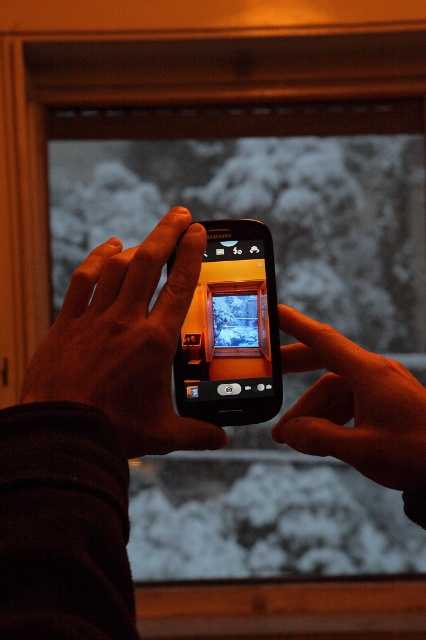
Is orange matte hand at center positioned at the back of black glossy phone at center?

No.

Measure the distance between point (305, 364) and camera.

Point (305, 364) is 23.88 inches from camera.

Which is behind, point (423, 408) or point (275, 289)?

The point (275, 289) is behind.

Identify the location of orange matte hand at center. This screenshot has width=426, height=640. (356, 410).

Who is positioned more to the left, black matte phone at center or black glossy phone at center?

black matte phone at center

Does black matte phone at center have a greater height compared to black glossy phone at center?

Correct, black matte phone at center is much taller as black glossy phone at center.

Find the location of a particular element. The image size is (426, 640). black matte phone at center is located at coordinates pyautogui.click(x=126, y=339).

Who is shorter, black matte phone at center or orange matte hand at center?

Standing shorter between the two is orange matte hand at center.

Does black matte phone at center lie in front of orange matte hand at center?

Yes, it is in front of orange matte hand at center.

Between point (121, 250) and point (414, 467), which one is positioned in front?

Point (414, 467) is more forward.

At what (x,y) coordinates should I click in order to perform the action: click on black matte phone at center. Please return your answer as a coordinate pair (x, y). Looking at the image, I should click on (126, 339).